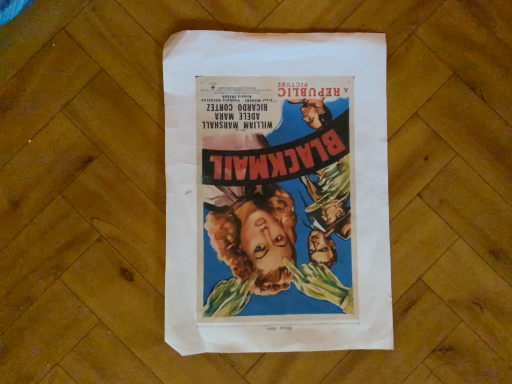
The width and height of the screenshot is (512, 384). I want to click on vintage paper poster at center, so point(276,192).

What do you see at coordinates (276, 192) in the screenshot? This screenshot has width=512, height=384. I see `vintage paper poster at center` at bounding box center [276, 192].

Identify the location of vintage paper poster at center. (276, 192).